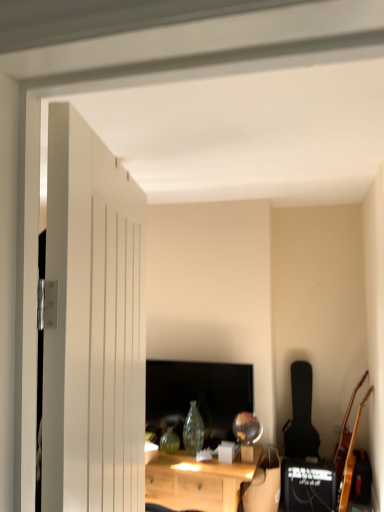
Question: From a real-world perspective, is black matte guitar at right, the first guitar from the left, over black matte speaker at lower right?

Choices:
 (A) yes
 (B) no

Answer: (A)

Question: Is black matte guitar at right, the 1th guitar when ordered from back to front, facing towards black matte speaker at lower right?

Choices:
 (A) yes
 (B) no

Answer: (A)

Question: Are black matte guitar at right, placed as the 2th guitar when sorted from front to back, and black matte speaker at lower right making contact?

Choices:
 (A) yes
 (B) no

Answer: (B)

Question: Is black matte speaker at lower right a part of black matte guitar at right, placed as the 2th guitar when sorted from front to back?

Choices:
 (A) no
 (B) yes

Answer: (A)

Question: From the image's perspective, does black matte guitar at right, the 1th guitar when ordered from back to front, appear lower than black matte speaker at lower right?

Choices:
 (A) no
 (B) yes

Answer: (A)

Question: Is black matte guitar at right, the 1th guitar when ordered from back to front, to the left or to the right of light wood desk at center in the image?

Choices:
 (A) left
 (B) right

Answer: (B)

Question: From the image's perspective, is black matte guitar at right, the 1th guitar when ordered from back to front, located above or below light wood desk at center?

Choices:
 (A) below
 (B) above

Answer: (B)

Question: Considering their positions, is black matte guitar at right, the 1th guitar when ordered from back to front, located in front of or behind light wood desk at center?

Choices:
 (A) behind
 (B) front

Answer: (A)

Question: Is point (291, 452) positioned closer to the camera than point (150, 488)?

Choices:
 (A) closer
 (B) farther

Answer: (B)

Question: Considering the positions of black matte speaker at lower right and black matte guitar at right, the first guitar from the left, in the image, is black matte speaker at lower right taller or shorter than black matte guitar at right, the first guitar from the left,?

Choices:
 (A) tall
 (B) short

Answer: (B)

Question: Is black matte speaker at lower right in front of or behind black matte guitar at right, the 1th guitar when ordered from back to front, in the image?

Choices:
 (A) front
 (B) behind

Answer: (A)

Question: From the image's perspective, relative to black matte guitar at right, placed as the 2th guitar when sorted from front to back, is black matte speaker at lower right above or below?

Choices:
 (A) below
 (B) above

Answer: (A)

Question: Is black matte speaker at lower right wider or thinner than black matte guitar at right, placed as the 2th guitar when sorted from right to left?

Choices:
 (A) thin
 (B) wide

Answer: (B)

Question: Is black matte speaker at lower right taller or shorter than light wood desk at center?

Choices:
 (A) tall
 (B) short

Answer: (B)

Question: From a real-world perspective, relative to light wood desk at center, is black matte speaker at lower right vertically above or below?

Choices:
 (A) below
 (B) above

Answer: (A)